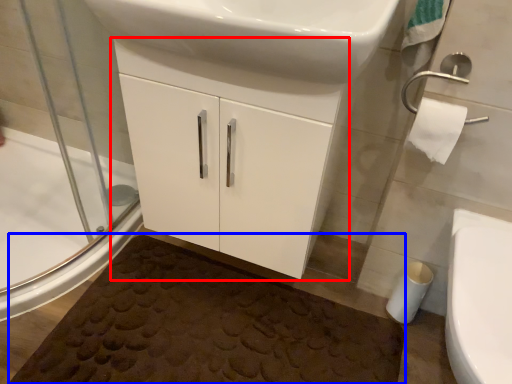
Question: Which point is further to the camera, bathroom cabinet (highlighted by a red box) or bath mat (highlighted by a blue box)?

Choices:
 (A) bathroom cabinet
 (B) bath mat

Answer: (B)